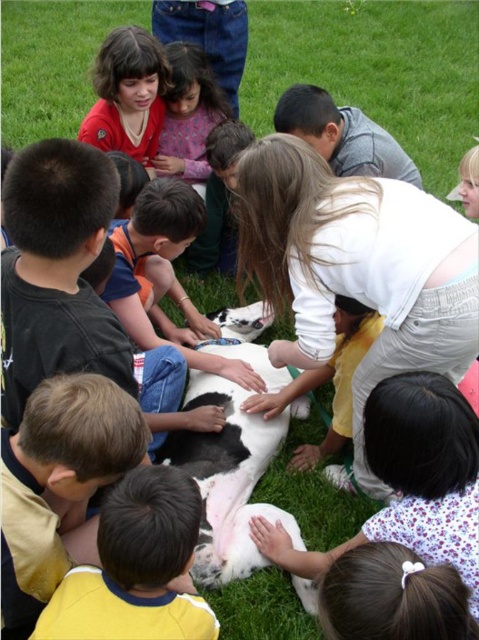
Question: Is smooth yellow shirt at lower left to the right of smooth pink shirt at center from the viewer's perspective?

Choices:
 (A) yes
 (B) no

Answer: (B)

Question: Can you confirm if white fluffy dog at lower center is bigger than black and white fur at center?

Choices:
 (A) yes
 (B) no

Answer: (B)

Question: Which point is closer to the camera?

Choices:
 (A) white fluffy dog at lower center
 (B) smooth yellow shirt at lower left
 (C) matte red shirt at upper left

Answer: (A)

Question: Can you confirm if black and white fur at center is positioned below matte red shirt at upper left?

Choices:
 (A) no
 (B) yes

Answer: (B)

Question: Which object is positioned farthest from the white fluffy dog at lower center?

Choices:
 (A) matte red shirt at upper left
 (B) smooth pink shirt at center
 (C) smooth yellow shirt at lower left
 (D) yellow jersey at lower left

Answer: (B)

Question: Considering the real-world distances, which object is farthest from the smooth pink shirt at center?

Choices:
 (A) yellow jersey at lower left
 (B) smooth yellow shirt at lower left
 (C) black and white fur at center

Answer: (A)